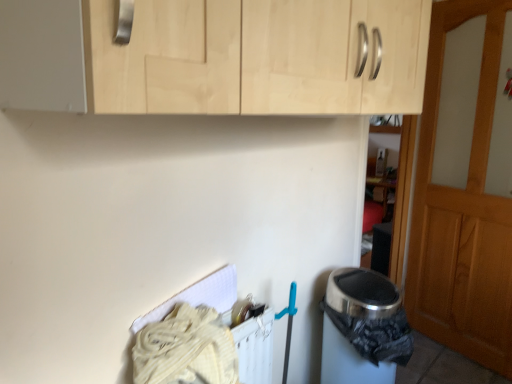
Question: Is light wood cabinet at upper center touching metallic trash can at lower right?

Choices:
 (A) yes
 (B) no

Answer: (B)

Question: From the image's perspective, is light wood cabinet at upper center under metallic trash can at lower right?

Choices:
 (A) no
 (B) yes

Answer: (A)

Question: Is light wood cabinet at upper center facing away from metallic trash can at lower right?

Choices:
 (A) yes
 (B) no

Answer: (B)

Question: Is light wood cabinet at upper center positioned in front of metallic trash can at lower right?

Choices:
 (A) no
 (B) yes

Answer: (B)

Question: Can we say light wood cabinet at upper center lies outside metallic trash can at lower right?

Choices:
 (A) no
 (B) yes

Answer: (B)

Question: Is metallic trash can at lower right wider or thinner than wooden door at right?

Choices:
 (A) thin
 (B) wide

Answer: (B)

Question: From a real-world perspective, is metallic trash can at lower right above or below wooden door at right?

Choices:
 (A) above
 (B) below

Answer: (B)

Question: Considering their positions, is metallic trash can at lower right located in front of or behind wooden door at right?

Choices:
 (A) front
 (B) behind

Answer: (A)

Question: Considering the positions of point (380, 279) and point (504, 9), is point (380, 279) closer or farther from the camera than point (504, 9)?

Choices:
 (A) closer
 (B) farther

Answer: (A)

Question: In terms of size, does wooden door at right appear bigger or smaller than light wood cabinet at upper center?

Choices:
 (A) big
 (B) small

Answer: (B)

Question: From a real-world perspective, is wooden door at right physically located above or below light wood cabinet at upper center?

Choices:
 (A) above
 (B) below

Answer: (B)

Question: From the image's perspective, is wooden door at right located above or below light wood cabinet at upper center?

Choices:
 (A) below
 (B) above

Answer: (A)

Question: Is wooden door at right wider or thinner than light wood cabinet at upper center?

Choices:
 (A) wide
 (B) thin

Answer: (B)

Question: Looking at their shapes, would you say light wood cabinet at upper center is wider or thinner than wooden door at right?

Choices:
 (A) thin
 (B) wide

Answer: (B)

Question: Is light wood cabinet at upper center spatially inside wooden door at right, or outside of it?

Choices:
 (A) inside
 (B) outside

Answer: (B)